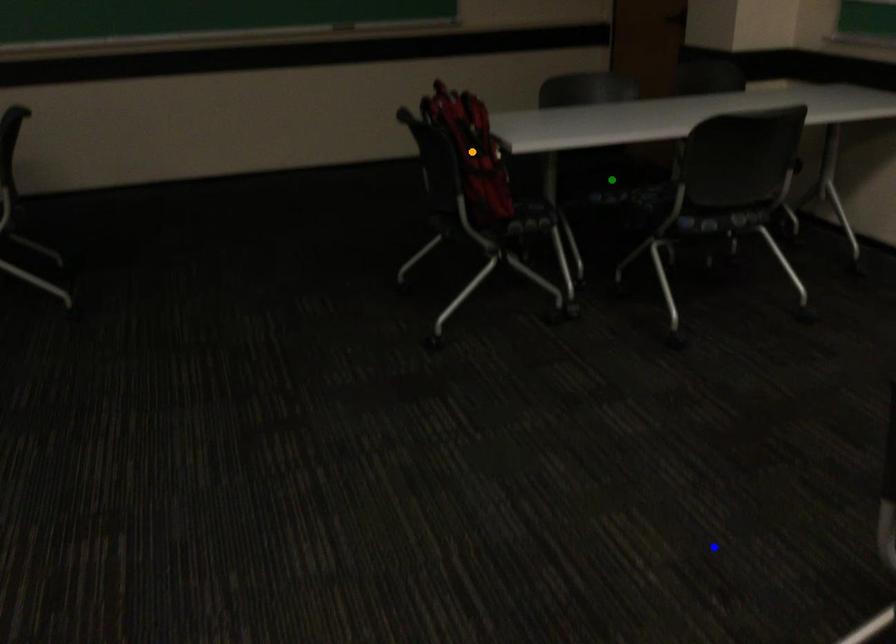
Order these from farthest to nearest:
orange point, green point, blue point

green point, orange point, blue point